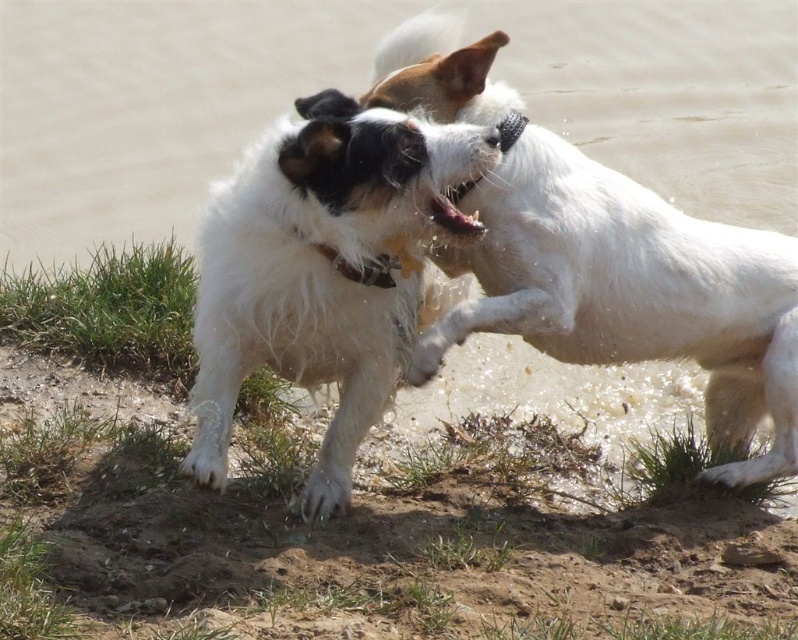
You are standing at a point where you want to throw a ball to the white fur dog at center. If the ball travels in a straight line, how far will it have to go to reach the dog?

The ball will have to travel 10.27 feet to reach the white fur dog at center.

You are standing at the edge of the water and want to place a small wooden bench in the scene. According to the coordinates provided, where should you place it so that it sits exactly on the dry sandy soil at lower center?

The dry sandy soil at lower center is located at coordinates point (356, 538), so you should place the bench at that exact point to ensure it sits on the dry sandy soil at lower center.

You are a dog owner who wants to ensure your dog stays dry. You see the dry sandy soil at lower center and the white fur dog at center. Which area should you move your dog away from to keep them dry?

The dry sandy soil at lower center is not as tall as the white fur dog at center, so moving the dog away from the dry sandy soil at lower center would keep them dry.